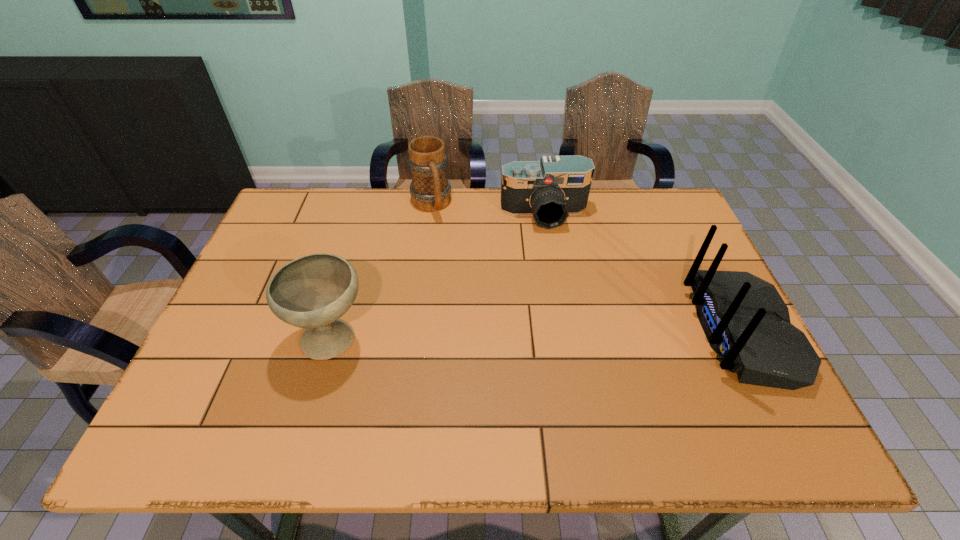
Where is `object that is at the near right corner`? This screenshot has height=540, width=960. object that is at the near right corner is located at coordinates (745, 320).

Where is `blank space at the far edge of the desktop`? blank space at the far edge of the desktop is located at coordinates (339, 210).

Where is `vacant region at the left edge of the desktop`? Image resolution: width=960 pixels, height=540 pixels. vacant region at the left edge of the desktop is located at coordinates pyautogui.click(x=282, y=255).

Where is `vacant space at the right edge`? The height and width of the screenshot is (540, 960). vacant space at the right edge is located at coordinates (704, 262).

In order to click on vacant space at the far left corner of the desktop in this screenshot , I will do `click(285, 208)`.

Locate an element on the screen. This screenshot has width=960, height=540. free location at the far right corner of the desktop is located at coordinates (639, 192).

Locate an element on the screen. This screenshot has width=960, height=540. free space at the near right corner is located at coordinates (729, 383).

Image resolution: width=960 pixels, height=540 pixels. Find the location of `vacant area that lies between the mug and the second object from right to left`. vacant area that lies between the mug and the second object from right to left is located at coordinates (488, 209).

Where is `vacant region between the rightmost object and the chalice`? The height and width of the screenshot is (540, 960). vacant region between the rightmost object and the chalice is located at coordinates (538, 335).

The width and height of the screenshot is (960, 540). Identify the location of free point between the leftmost object and the camera. (439, 276).